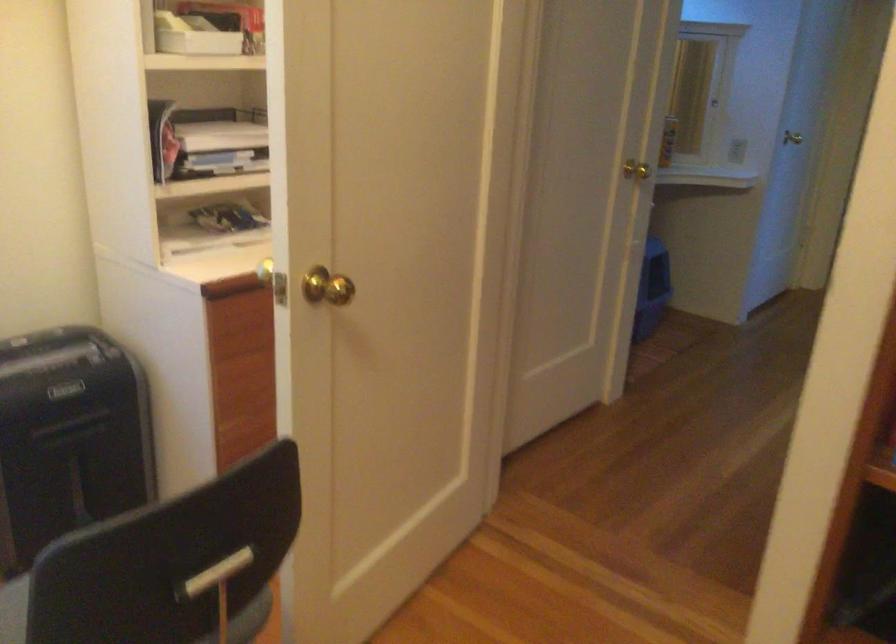
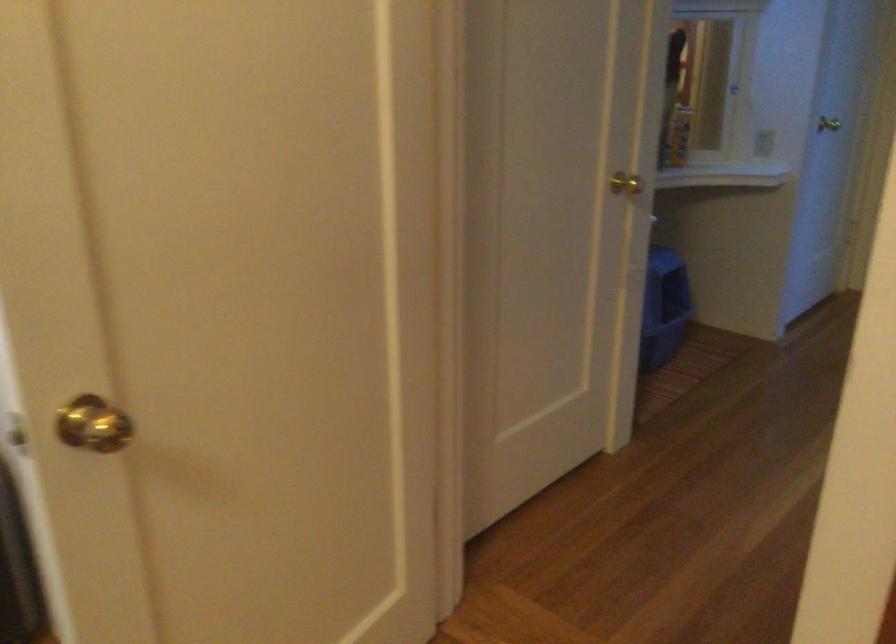
Looking at this image, what movement of the cameraman would produce the second image?

The movement direction of the cameraman is right, forward.